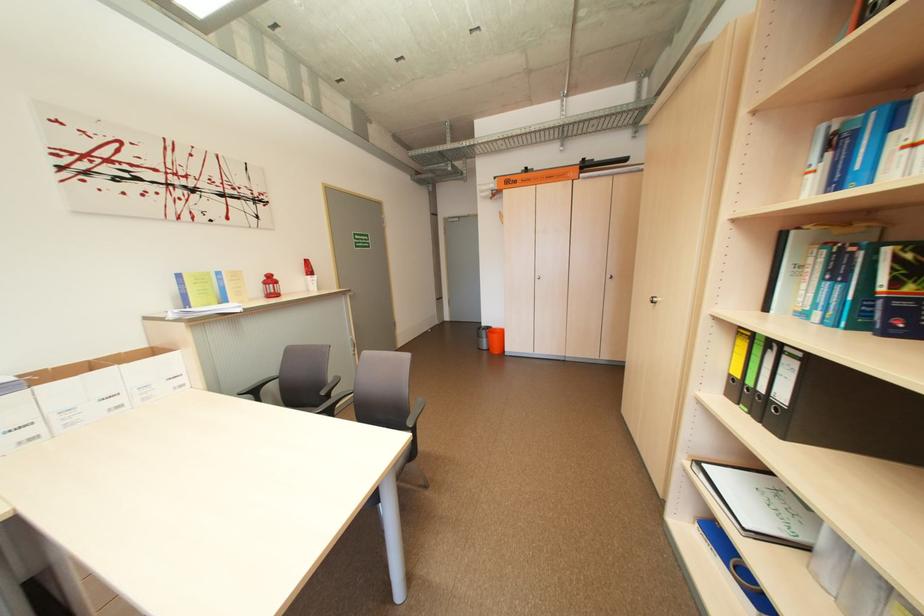
Find where to lift the orange trash bin. Please return your answer as a coordinate pair (x, y).

(495, 339)